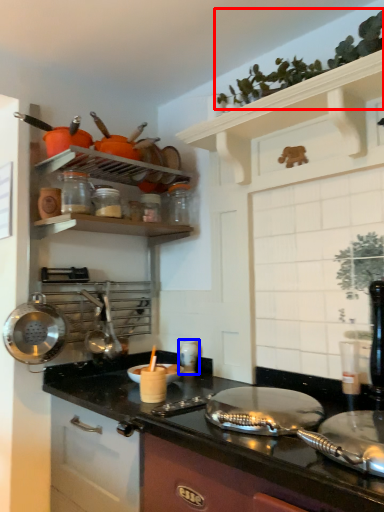
Question: Which point is further to the camera, plant (highlighted by a red box) or appliance (highlighted by a blue box)?

Choices:
 (A) plant
 (B) appliance

Answer: (B)